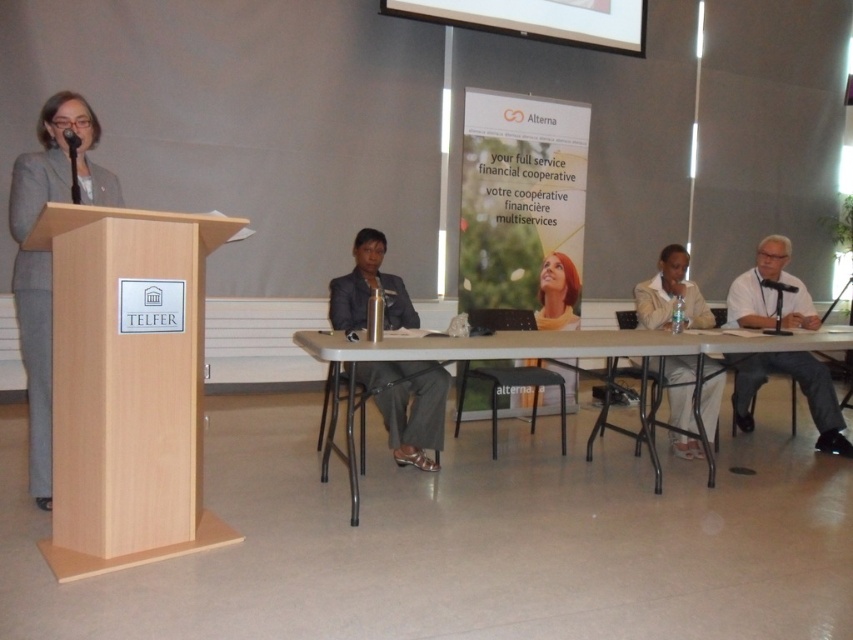
You are organizing a small meeting for two people. You have a light wood podium at left and a white plastic table at center. Which object would be more suitable for placing two chairs to have a private conversation?

The white plastic table at center is larger than the light wood podium at left, so it would be more suitable for placing two chairs to have a private conversation.